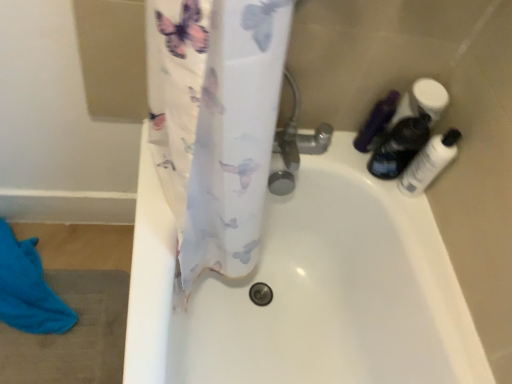
Question: Is matte black bottle at upper right, the 1th toiletry from the left, oriented away from blue cotton beach towel at lower left?

Choices:
 (A) no
 (B) yes

Answer: (A)

Question: Is matte black bottle at upper right, placed as the 3th toiletry when sorted from right to left, wider than blue cotton beach towel at lower left?

Choices:
 (A) no
 (B) yes

Answer: (A)

Question: Is matte black bottle at upper right, the 1th toiletry from the left, bigger than blue cotton beach towel at lower left?

Choices:
 (A) yes
 (B) no

Answer: (B)

Question: Can you confirm if matte black bottle at upper right, placed as the 3th toiletry when sorted from right to left, is taller than blue cotton beach towel at lower left?

Choices:
 (A) no
 (B) yes

Answer: (B)

Question: Is matte black bottle at upper right, the 1th toiletry from the left, at the left side of blue cotton beach towel at lower left?

Choices:
 (A) no
 (B) yes

Answer: (A)

Question: Can you confirm if transparent plastic bottle at right, marked as the third toiletry in a left-to-right arrangement, is bigger than translucent plastic bottles at upper right, which is the 2th toiletry in right-to-left order?

Choices:
 (A) yes
 (B) no

Answer: (B)

Question: Is transparent plastic bottle at right, marked as the 1th toiletry in a right-to-left arrangement, at the left side of translucent plastic bottles at upper right, the 2th toiletry in the left-to-right sequence?

Choices:
 (A) yes
 (B) no

Answer: (B)

Question: Is transparent plastic bottle at right, marked as the 1th toiletry in a right-to-left arrangement, facing towards translucent plastic bottles at upper right, the 2th toiletry in the left-to-right sequence?

Choices:
 (A) yes
 (B) no

Answer: (B)

Question: From the image's perspective, is transparent plastic bottle at right, marked as the third toiletry in a left-to-right arrangement, located beneath translucent plastic bottles at upper right, which is the 2th toiletry in right-to-left order?

Choices:
 (A) yes
 (B) no

Answer: (A)

Question: Is transparent plastic bottle at right, marked as the third toiletry in a left-to-right arrangement, shorter than translucent plastic bottles at upper right, the 2th toiletry in the left-to-right sequence?

Choices:
 (A) no
 (B) yes

Answer: (B)

Question: Is transparent plastic bottle at right, marked as the 1th toiletry in a right-to-left arrangement, far from translucent plastic bottles at upper right, the 2th toiletry in the left-to-right sequence?

Choices:
 (A) yes
 (B) no

Answer: (B)

Question: Considering the relative sizes of transparent plastic bottle at right, marked as the third toiletry in a left-to-right arrangement, and blue cotton beach towel at lower left in the image provided, is transparent plastic bottle at right, marked as the third toiletry in a left-to-right arrangement, smaller than blue cotton beach towel at lower left?

Choices:
 (A) yes
 (B) no

Answer: (A)